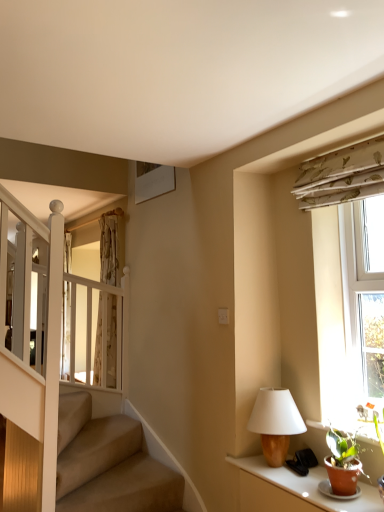
At what (x,y) coordinates should I click in order to perform the action: click on vacant area situated below wooden table lamp at right (from a real-world perspective). Please return your answer as a coordinate pair (x, y). The height and width of the screenshot is (512, 384). Looking at the image, I should click on (280, 465).